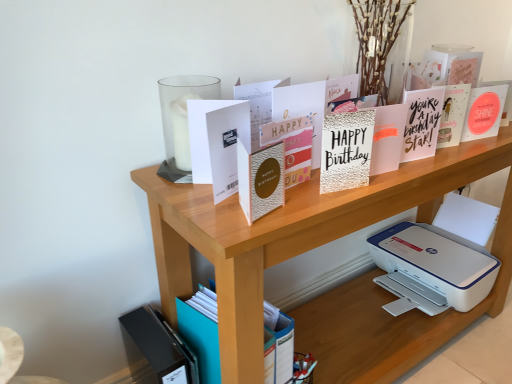
This screenshot has height=384, width=512. In order to click on free location to the right of gold textured card at center, which ranks as the fifth paperback book in right-to-left order in this screenshot , I will do `click(360, 188)`.